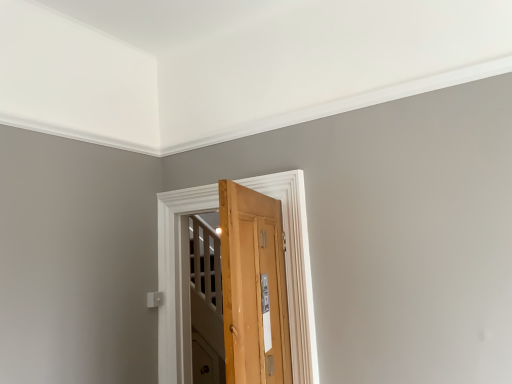
The width and height of the screenshot is (512, 384). What do you see at coordinates (175, 276) in the screenshot?
I see `wooden door at center` at bounding box center [175, 276].

Measure the distance between wooden door at center and camera.

A distance of 2.51 meters exists between wooden door at center and camera.

The image size is (512, 384). Find the location of `wooden door at center`. wooden door at center is located at coordinates (175, 276).

You are a GUI agent. You are given a task and a screenshot of the screen. Output one action in this format:
    pyautogui.click(x=<x>, y=<y>)
    Task: Click on the wooden door at center
    Image resolution: width=512 pixels, height=384 pixels.
    Given the screenshot: What is the action you would take?
    pyautogui.click(x=175, y=276)